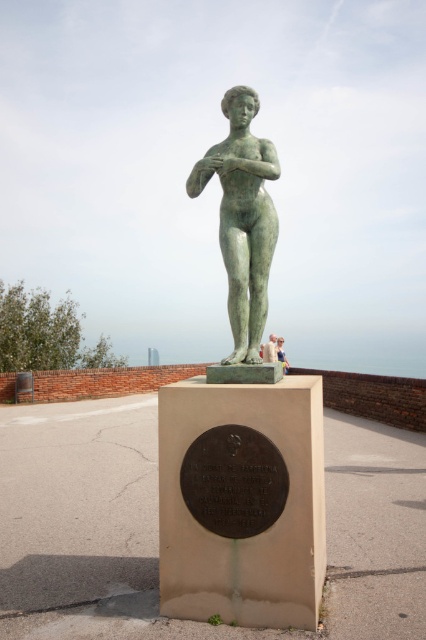
You are a maintenance worker needing to clean both the matte bronze statue at center and the light brown wooden bench at center. You have a 32 inch wide cleaning cart. Can you move the cart between the two objects without hitting either?

The matte bronze statue at center and the light brown wooden bench at center are 31.99 inches apart from each other. Since the cart is 32 inches wide, it will not fit between them. You need to move the objects or choose a narrower cart.

You are an art student observing two bronze statues in a park. You see the green bronze statue at center and the matte bronze statue at center. Which statue is positioned to the left?

The green bronze statue at center is to the left of the matte bronze statue at center.